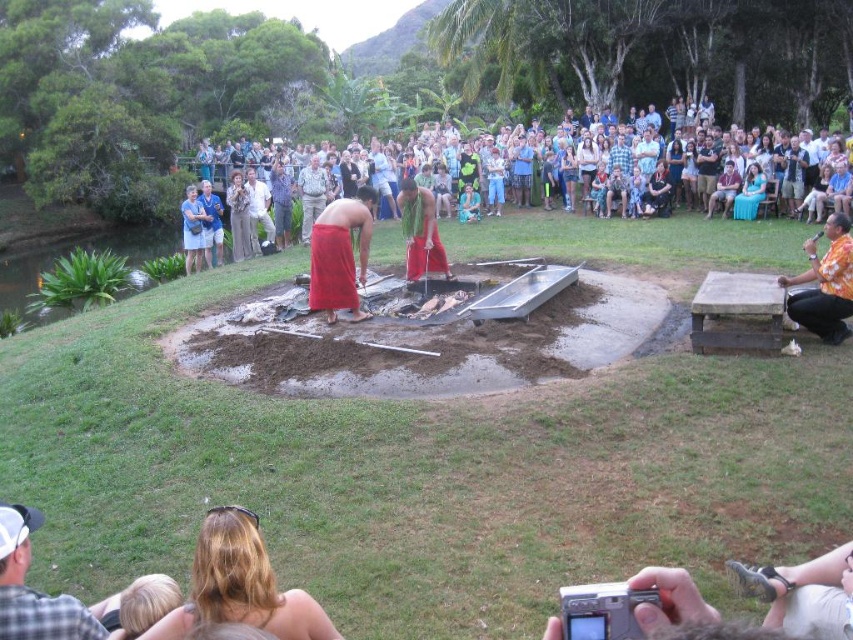
You are a photographer standing in the center of the scene. You want to take a photo that includes both the point at coordinates point (308, 204) and point (746, 176). Which point is closer to you so that you can focus on it first?

Point (308, 204) is closer to you than point (746, 176), so you should focus on it first.

You are a photographer at this event and want to capture a photo of both the camouflage shirt at center and the blue fabric dress at center. Which one will appear higher in the photo?

The camouflage shirt at center appears higher in the photo because it is above the blue fabric dress at center.